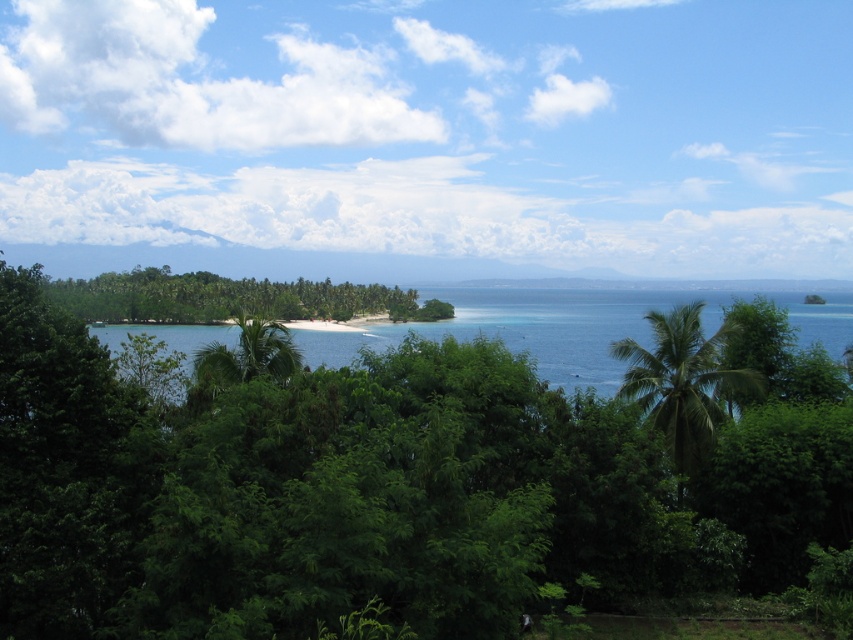
Question: Does green leafy palm tree at center-right appear over green leafy palm tree at center?

Choices:
 (A) no
 (B) yes

Answer: (A)

Question: Which object is the farthest from the green leafy island at center?

Choices:
 (A) green leafy palm tree at center
 (B) clear blue water at center

Answer: (A)

Question: Can you confirm if clear blue water at center is positioned above green leafy palm tree at center-right?

Choices:
 (A) yes
 (B) no

Answer: (A)

Question: Which object is the closest to the green leafy palm tree at center?

Choices:
 (A) clear blue water at center
 (B) green leafy island at center

Answer: (A)

Question: Considering the relative positions of green leafy island at center and green leafy palm tree at center in the image provided, where is green leafy island at center located with respect to green leafy palm tree at center?

Choices:
 (A) right
 (B) left

Answer: (B)

Question: Which is nearer to the green leafy island at center?

Choices:
 (A) green leafy palm tree at center-right
 (B) green leafy tree at center
 (C) clear blue water at center
 (D) green leafy palm tree at center

Answer: (C)